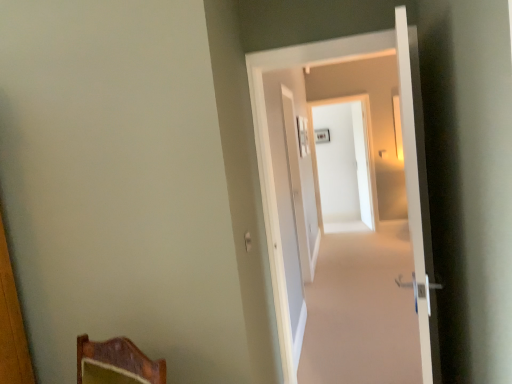
Question: Can you confirm if white glossy door at center, positioned as the first screen door in left-to-right order, is bigger than white glossy door at right, marked as the second door in a back-to-front arrangement?

Choices:
 (A) yes
 (B) no

Answer: (B)

Question: From a real-world perspective, is white glossy door at center, arranged as the 2th screen door when viewed from the right, on white glossy door at right, the first door in the front-to-back sequence?

Choices:
 (A) yes
 (B) no

Answer: (B)

Question: Is white glossy door at right, the first door in the front-to-back sequence, completely or partially inside white glossy door at center, marked as the 1th screen door in a front-to-back arrangement?

Choices:
 (A) yes
 (B) no

Answer: (B)

Question: Is white glossy door at center, arranged as the 2th screen door when viewed from the right, at the left side of white glossy door at right, the first door in the front-to-back sequence?

Choices:
 (A) yes
 (B) no

Answer: (A)

Question: Can we say white glossy door at center, positioned as the first screen door in left-to-right order, lies outside white glossy door at right, marked as the second door in a back-to-front arrangement?

Choices:
 (A) no
 (B) yes

Answer: (B)

Question: Considering the positions of point (291, 187) and point (303, 201), is point (291, 187) closer or farther from the camera than point (303, 201)?

Choices:
 (A) closer
 (B) farther

Answer: (A)

Question: From a real-world perspective, is white glossy door at center, the 2th screen door in the back-to-front sequence, above or below white glossy door at center, placed as the first door when sorted from back to front?

Choices:
 (A) above
 (B) below

Answer: (B)

Question: Is white glossy door at center, the 2th screen door in the back-to-front sequence, to the left or to the right of white glossy door at center, placed as the first door when sorted from back to front, in the image?

Choices:
 (A) right
 (B) left

Answer: (B)

Question: In terms of width, does white glossy door at center, positioned as the first screen door in left-to-right order, look wider or thinner when compared to white glossy door at center, acting as the second door starting from the front?

Choices:
 (A) thin
 (B) wide

Answer: (A)

Question: From a real-world perspective, is white glossy screen door at center, acting as the second screen door starting from the left, above or below white glossy door at center, the 2th screen door in the back-to-front sequence?

Choices:
 (A) above
 (B) below

Answer: (A)

Question: Looking at their shapes, would you say white glossy screen door at center, the 1th screen door when ordered from back to front, is wider or thinner than white glossy door at center, positioned as the first screen door in left-to-right order?

Choices:
 (A) thin
 (B) wide

Answer: (A)

Question: In the image, is white glossy screen door at center, the 1th screen door when ordered from back to front, on the left side or the right side of white glossy door at center, arranged as the 2th screen door when viewed from the right?

Choices:
 (A) left
 (B) right

Answer: (B)

Question: From their relative heights in the image, would you say white glossy screen door at center, the 1th screen door when ordered from back to front, is taller or shorter than white glossy door at center, positioned as the first screen door in left-to-right order?

Choices:
 (A) short
 (B) tall

Answer: (B)

Question: Does point (324, 230) appear closer or farther from the camera than point (312, 248)?

Choices:
 (A) farther
 (B) closer

Answer: (A)

Question: Looking at their shapes, would you say white glossy screen door at center, which ranks as the first screen door in right-to-left order, is wider or thinner than white glossy door at center, placed as the first door when sorted from back to front?

Choices:
 (A) thin
 (B) wide

Answer: (A)